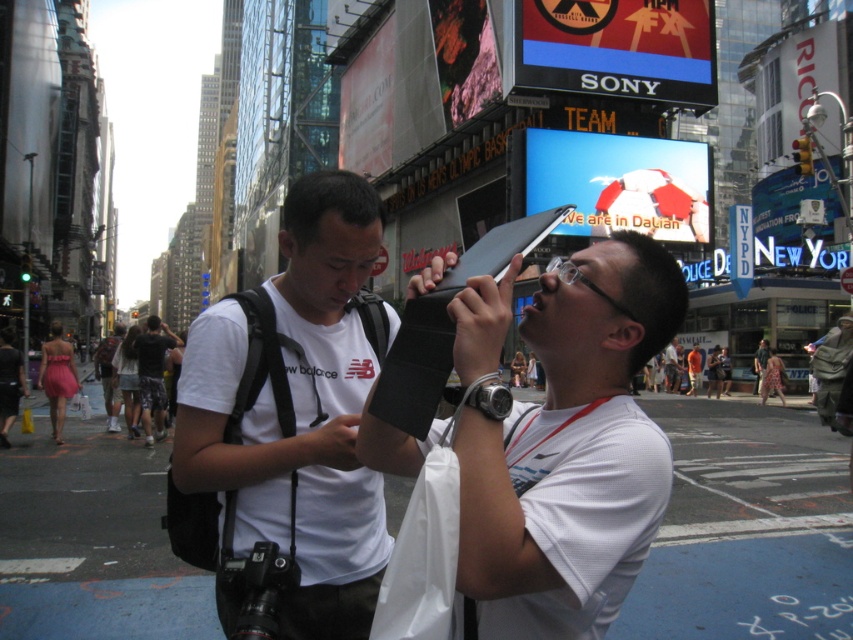
You are a street vendor in Times Square, New York City, and you need to place a new sign between the black matte wallet at center and the dark gray shorts at center. Which object should you place the sign closer to if the sign requires less space due to its small size?

The black matte wallet at center has a smaller width than the dark gray shorts at center, so the sign should be placed closer to the black matte wallet at center to accommodate its smaller size.

You are a fashion designer analyzing the urban scene in Times Square. You notice a point at coordinates (294, 416). What item is located at that specific coordinate?

The point at coordinates (294, 416) indicates the white matte t shirt at center.